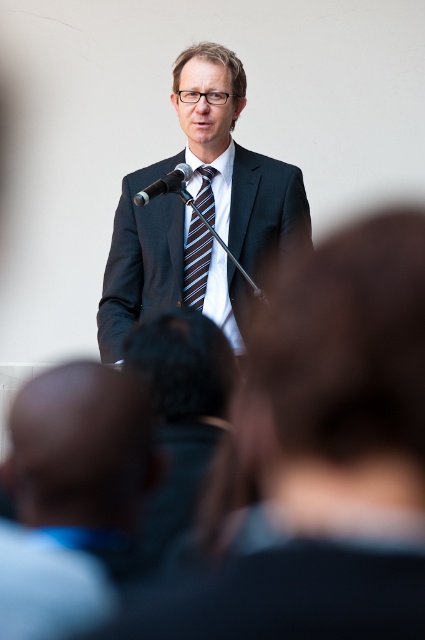
Is brown striped tie at center below black metallic microphone at upper center?

Yes.

Between point (212, 173) and point (155, 182), which one is positioned behind?

Point (212, 173)

Where is `brown striped tie at center`? The image size is (425, 640). brown striped tie at center is located at coordinates (195, 262).

Does dark blue suit at center appear under black metallic microphone at upper center?

Indeed, dark blue suit at center is positioned under black metallic microphone at upper center.

Who is lower down, dark blue suit at center or black metallic microphone at upper center?

dark blue suit at center is lower down.

Find the location of a particular element. Image resolution: width=425 pixels, height=640 pixels. dark blue suit at center is located at coordinates (201, 211).

Which is below, dark blue suit at center or brown striped tie at center?

brown striped tie at center

Does dark blue suit at center have a smaller size compared to brown striped tie at center?

A: No, dark blue suit at center is not smaller than brown striped tie at center.

Between point (209, 220) and point (187, 298), which one is positioned behind?

The point (209, 220) is behind.

The image size is (425, 640). I want to click on dark blue suit at center, so click(201, 211).